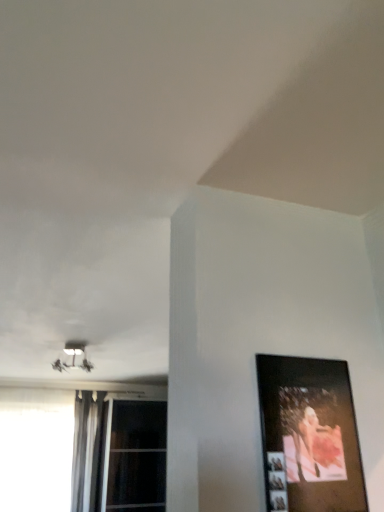
Measure the distance between transparent glass window at lower left, which is the second window from left to right, and camera.

transparent glass window at lower left, which is the second window from left to right, is 5.17 meters away from camera.

What do you see at coordinates (36, 449) in the screenshot? I see `white glass window at lower left, the second window from the right` at bounding box center [36, 449].

The height and width of the screenshot is (512, 384). I want to click on silky gray curtain at left, so click(87, 450).

Find the location of a particular element. white plastic lamp at upper left is located at coordinates (73, 356).

Could white plastic lamp at upper left be considered to be inside silky gray curtain at left?

No, white plastic lamp at upper left is not inside silky gray curtain at left.

Based on the photo, which point is more distant from viewer, (102, 398) or (87, 361)?

The point (102, 398) is more distant.

Is silky gray curtain at left in contact with white plastic lamp at upper left?

No, silky gray curtain at left is not next to white plastic lamp at upper left.

Looking at the image, does silky gray curtain at left seem bigger or smaller compared to white plastic lamp at upper left?

silky gray curtain at left is bigger than white plastic lamp at upper left.

Is white plastic lamp at upper left positioned with its back to wooden picture frame at right?

That's not correct — white plastic lamp at upper left is not looking away from wooden picture frame at right.

How many degrees apart are the facing directions of white plastic lamp at upper left and wooden picture frame at right?

There is a 0.955-degree angle between the facing directions of white plastic lamp at upper left and wooden picture frame at right.

Is white plastic lamp at upper left not inside wooden picture frame at right?

Yes, white plastic lamp at upper left is not within wooden picture frame at right.

Is white plastic lamp at upper left completely or partially outside of transparent glass window at lower left, acting as the 1th window starting from the right?

That's correct, white plastic lamp at upper left is outside of transparent glass window at lower left, acting as the 1th window starting from the right.

From a real-world perspective, which object rests below the other?

transparent glass window at lower left, acting as the 1th window starting from the right, is physically lower.

From the picture: From the image's perspective, is white plastic lamp at upper left beneath transparent glass window at lower left, which is the second window from left to right?

No, from the image's perspective, white plastic lamp at upper left is not below transparent glass window at lower left, which is the second window from left to right.

Considering the positions of points (77, 352) and (135, 447), is point (77, 352) farther from camera compared to point (135, 447)?

No, it is not.

In terms of size, does wooden picture frame at right appear bigger or smaller than transparent glass window at lower left, acting as the 1th window starting from the right?

wooden picture frame at right is smaller than transparent glass window at lower left, acting as the 1th window starting from the right.

Is wooden picture frame at right looking in the opposite direction of transparent glass window at lower left, which is the second window from left to right?

Correct, wooden picture frame at right is looking away from transparent glass window at lower left, which is the second window from left to right.

Is white glass window at lower left, the first window positioned from the left, surrounded by transparent glass window at lower left, which is the second window from left to right?

No, white glass window at lower left, the first window positioned from the left, is located outside of transparent glass window at lower left, which is the second window from left to right.

Where is `window below the white glass window at lower left, the second window from the right (from the image's perspective)`? window below the white glass window at lower left, the second window from the right (from the image's perspective) is located at coordinates (133, 456).

Could you tell me if transparent glass window at lower left, acting as the 1th window starting from the right, is turned towards white glass window at lower left, the first window positioned from the left?

No, transparent glass window at lower left, acting as the 1th window starting from the right, is not facing towards white glass window at lower left, the first window positioned from the left.

Considering the relative sizes of transparent glass window at lower left, acting as the 1th window starting from the right, and white glass window at lower left, the second window from the right, in the image provided, is transparent glass window at lower left, acting as the 1th window starting from the right, thinner than white glass window at lower left, the second window from the right,?

No, transparent glass window at lower left, acting as the 1th window starting from the right, is not thinner than white glass window at lower left, the second window from the right.

From the picture: Can you confirm if wooden picture frame at right is positioned to the left of white glass window at lower left, the first window positioned from the left?

No, wooden picture frame at right is not to the left of white glass window at lower left, the first window positioned from the left.

Considering their positions, is wooden picture frame at right located in front of or behind white glass window at lower left, the second window from the right?

Visually, wooden picture frame at right is located in front of white glass window at lower left, the second window from the right.

Considering the sizes of wooden picture frame at right and white glass window at lower left, the second window from the right, in the image, is wooden picture frame at right bigger or smaller than white glass window at lower left, the second window from the right,?

Clearly, wooden picture frame at right is smaller in size than white glass window at lower left, the second window from the right.

Based on the photo, from a real-world perspective, is wooden picture frame at right physically located above or below white glass window at lower left, the second window from the right?

wooden picture frame at right is situated higher than white glass window at lower left, the second window from the right, in the real world.

Does silky gray curtain at left lie behind white glass window at lower left, the second window from the right?

Yes.

From a real-world perspective, who is located lower, silky gray curtain at left or white glass window at lower left, the first window positioned from the left?

In real-world perspective, white glass window at lower left, the first window positioned from the left, is lower.

Does silky gray curtain at left turn towards white glass window at lower left, the second window from the right?

No, silky gray curtain at left is not aimed at white glass window at lower left, the second window from the right.

Considering the sizes of objects silky gray curtain at left and white glass window at lower left, the second window from the right, in the image provided, who is smaller, silky gray curtain at left or white glass window at lower left, the second window from the right,?

silky gray curtain at left.

Where is `curtain that appears below the white plastic lamp at upper left (from the image's perspective)`? The image size is (384, 512). curtain that appears below the white plastic lamp at upper left (from the image's perspective) is located at coordinates (87, 450).

The width and height of the screenshot is (384, 512). What are the coordinates of `picture frame that appears in front of the white plastic lamp at upper left` in the screenshot? It's located at (311, 432).

Estimate the real-world distances between objects in this image. Which object is further from white plastic lamp at upper left, transparent glass window at lower left, acting as the 1th window starting from the right, or wooden picture frame at right?

wooden picture frame at right is further to white plastic lamp at upper left.

Looking at the image, which one is located closer to transparent glass window at lower left, acting as the 1th window starting from the right, white plastic lamp at upper left or white glass window at lower left, the first window positioned from the left?

white glass window at lower left, the first window positioned from the left, is positioned closer to the anchor transparent glass window at lower left, acting as the 1th window starting from the right.

Estimate the real-world distances between objects in this image. Which object is further from transparent glass window at lower left, which is the second window from left to right, white glass window at lower left, the first window positioned from the left, or white plastic lamp at upper left?

Among the two, white plastic lamp at upper left is located further to transparent glass window at lower left, which is the second window from left to right.

Which object lies further to the anchor point white glass window at lower left, the second window from the right, wooden picture frame at right or transparent glass window at lower left, acting as the 1th window starting from the right?

wooden picture frame at right.

Looking at the image, which one is located closer to transparent glass window at lower left, which is the second window from left to right, white glass window at lower left, the second window from the right, or wooden picture frame at right?

Among the two, white glass window at lower left, the second window from the right, is located nearer to transparent glass window at lower left, which is the second window from left to right.

When comparing their distances from silky gray curtain at left, does white glass window at lower left, the second window from the right, or white plastic lamp at upper left seem further?

white plastic lamp at upper left is positioned further to the anchor silky gray curtain at left.

Looking at the image, which one is located further to white glass window at lower left, the first window positioned from the left, silky gray curtain at left or wooden picture frame at right?

wooden picture frame at right.

Based on their spatial positions, is silky gray curtain at left or wooden picture frame at right closer to white plastic lamp at upper left?

Among the two, silky gray curtain at left is located nearer to white plastic lamp at upper left.

The width and height of the screenshot is (384, 512). What are the coordinates of `lamp between wooden picture frame at right and transparent glass window at lower left, acting as the 1th window starting from the right, along the z-axis` in the screenshot? It's located at (73, 356).

Image resolution: width=384 pixels, height=512 pixels. Find the location of `window between white plastic lamp at upper left and silky gray curtain at left from top to bottom`. window between white plastic lamp at upper left and silky gray curtain at left from top to bottom is located at coordinates (36, 449).

You are a GUI agent. You are given a task and a screenshot of the screen. Output one action in this format:
    pyautogui.click(x=<x>, y=<y>)
    Task: Click on the window between wooden picture frame at right and white glass window at lower left, the second window from the right, from front to back
    The height and width of the screenshot is (512, 384).
    Given the screenshot: What is the action you would take?
    pyautogui.click(x=133, y=456)

You are a GUI agent. You are given a task and a screenshot of the screen. Output one action in this format:
    pyautogui.click(x=<x>, y=<y>)
    Task: Click on the window between white plastic lamp at upper left and transparent glass window at lower left, acting as the 1th window starting from the right, vertically
    
    Given the screenshot: What is the action you would take?
    pyautogui.click(x=36, y=449)